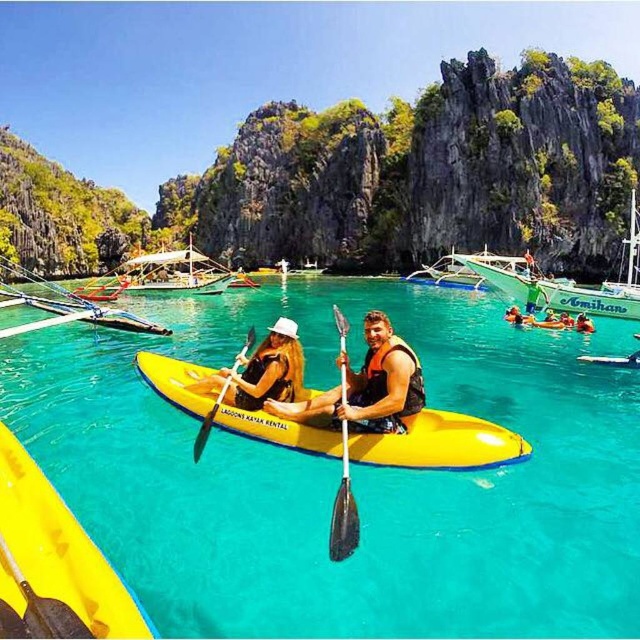
You are a photographer standing on the shore of the lagoon and want to take a photo of the transparent yellow kayak at center. If your camera has a maximum focus range of 30 meters, will you be able to capture the kayak clearly?

The transparent yellow kayak at center and the camera are 35.07 meters apart from each other, which exceeds the camera maximum focus range of 30 meters. Therefore, the kayak will not be captured clearly.

You are planning to take a group of tourists on a guided tour of the lagoon. You need to choose between the transparent yellow kayak at center and the green plastic boat at upper right. Which vessel would allow passengers to have a better view of the underwater marine life, and why?

The transparent yellow kayak at center would provide a better view of the underwater marine life because its transparent material allows passengers to see through the bottom, unlike the green plastic boat at upper right which is likely solid and opaque.

You are a photographer trying to capture the kayakers in the transparent yellow kayak at center and the yellow life vest at center. From the photographer perspective, which object is positioned to the left?

The transparent yellow kayak at center is positioned to the left of the yellow life vest at center.